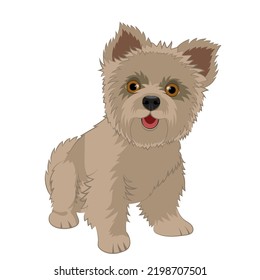
At what (x,y) coordinates should I click in order to perform the action: click on chest. Please return your answer as a coordinate pair (x, y). Looking at the image, I should click on [145, 176].